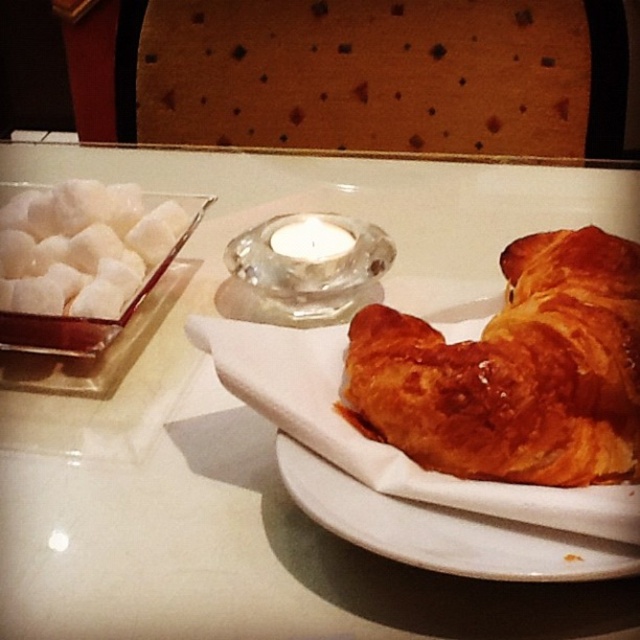
Question: Which object is the closest to the translucent glass candle at center?

Choices:
 (A) white ceramic plate at lower right
 (B) golden brown flaky croissant at center

Answer: (B)

Question: Which point appears closest to the camera in this image?

Choices:
 (A) (3, 256)
 (B) (291, 227)
 (C) (371, 522)

Answer: (C)

Question: Does golden brown flaky croissant at center have a lesser width compared to translucent glass candle at center?

Choices:
 (A) yes
 (B) no

Answer: (B)

Question: Does white ceramic plate at lower right come behind translucent glass candle at center?

Choices:
 (A) no
 (B) yes

Answer: (A)

Question: Which point is farther to the camera?

Choices:
 (A) white ceramic plate at lower right
 (B) white sugar cubes at left

Answer: (B)

Question: Does golden brown flaky croissant at center appear under white sugar cubes at left?

Choices:
 (A) yes
 (B) no

Answer: (A)